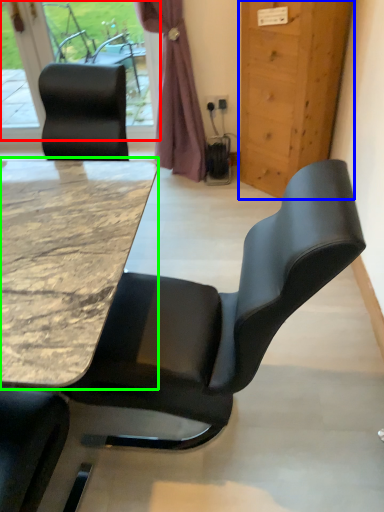
Question: Which is farther away from window (highlighted by a red box)? door (highlighted by a blue box) or table (highlighted by a green box)?

Choices:
 (A) door
 (B) table

Answer: (B)